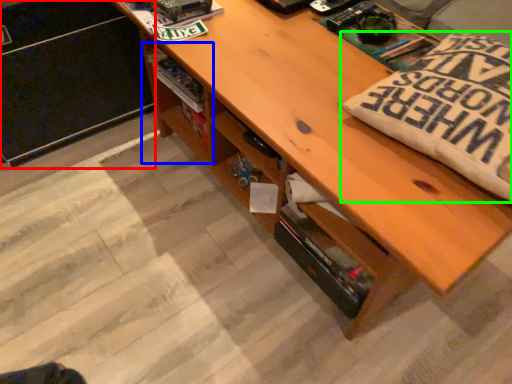
Question: Which is nearer to the file cabinet (highlighted by a red box)? shelf (highlighted by a blue box) or throw pillow (highlighted by a green box).

Choices:
 (A) shelf
 (B) throw pillow

Answer: (A)